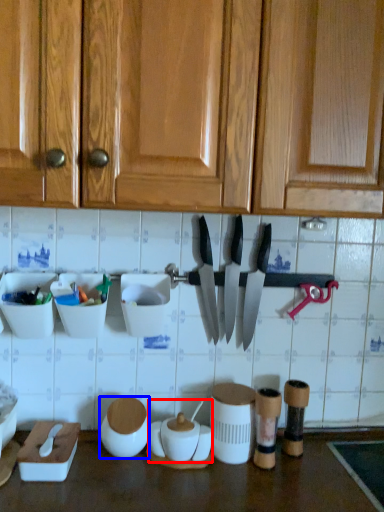
Question: Which object appears closest to the camera in this image, pottery (highlighted by a red box) or tableware (highlighted by a blue box)?

Choices:
 (A) pottery
 (B) tableware

Answer: (A)